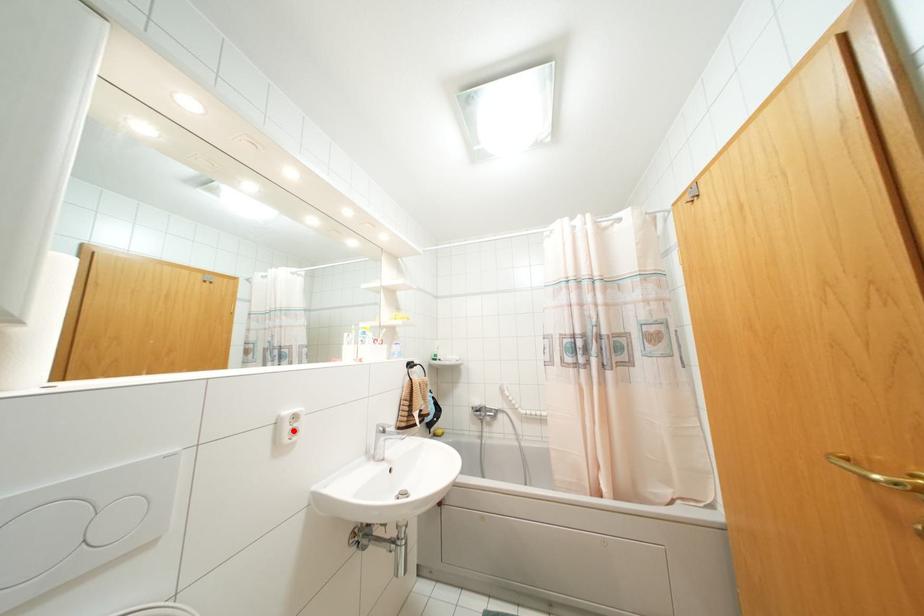
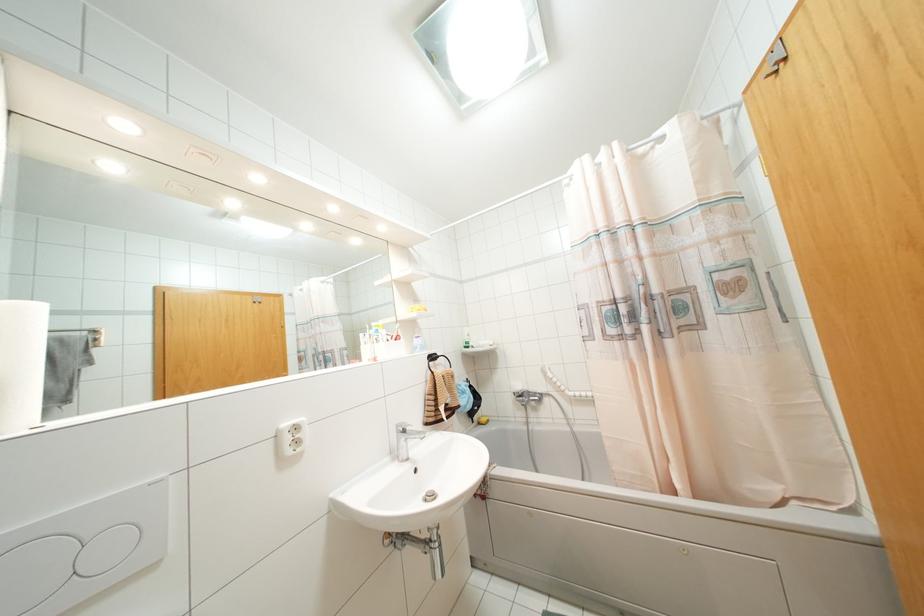
Find the pixel in the second image that matches the highlighted location in the first image.

(297, 442)